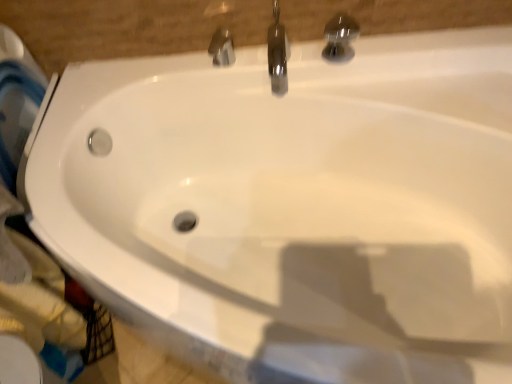
Question: Looking at their shapes, would you say polished chrome faucet at upper center, which is the second tap from right to left, is wider or thinner than polished chrome faucet at upper center, which ranks as the 3th tap in right-to-left order?

Choices:
 (A) thin
 (B) wide

Answer: (B)

Question: In terms of size, does polished chrome faucet at upper center, which is counted as the second tap, starting from the left, appear bigger or smaller than polished chrome faucet at upper center, which ranks as the first tap in left-to-right order?

Choices:
 (A) big
 (B) small

Answer: (A)

Question: Based on their relative distances, which object is farther from the polished chrome faucet at upper center, which ranks as the first tap in left-to-right order?

Choices:
 (A) polished chrome tap at upper center, the first tap positioned from the right
 (B) polished chrome faucet at upper center, which is the second tap from right to left

Answer: (A)

Question: Which is nearer to the polished chrome tap at upper center, the first tap positioned from the right?

Choices:
 (A) polished chrome faucet at upper center, which is counted as the second tap, starting from the left
 (B) polished chrome faucet at upper center, which ranks as the 3th tap in right-to-left order

Answer: (A)